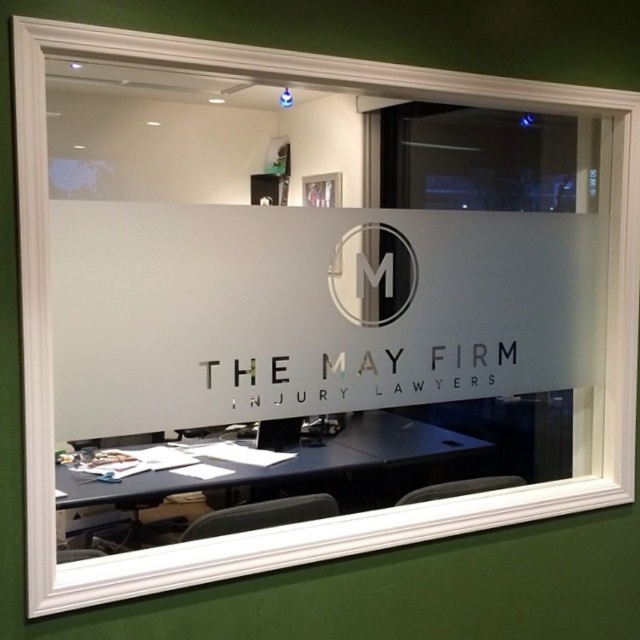
You are a visitor standing outside the office looking through the frosted glass window. You notice the black glossy table at lower center and the satin black circle at center. Which object appears taller when viewed from your position outside?

The black glossy table at lower center appears taller than the satin black circle at center when viewed from outside the office.

You are standing outside the office looking through the frosted glass window. You notice a point marked at coordinate (262, 480) on the window. What object does this coordinate correspond to inside the office?

The point at coordinate (262, 480) corresponds to the black glossy table at lower center inside the office.